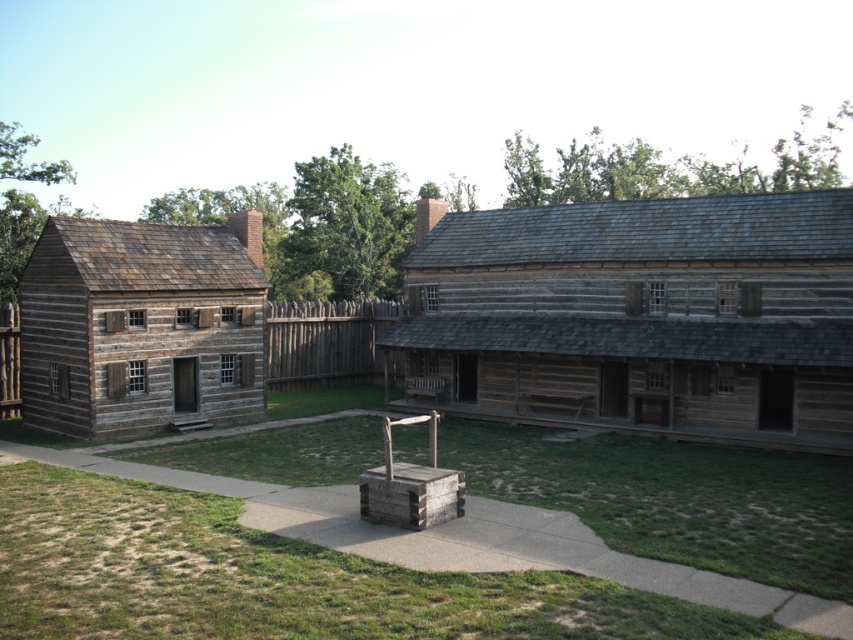
Does wooden well at center appear over light brown wooden log cabin at left?

Actually, wooden well at center is below light brown wooden log cabin at left.

Which is above, wooden well at center or light brown wooden log cabin at left?

Positioned higher is light brown wooden log cabin at left.

Describe the element at coordinates (274, 579) in the screenshot. This screenshot has width=853, height=640. I see `wooden well at center` at that location.

Locate an element on the screen. The image size is (853, 640). wooden well at center is located at coordinates (274, 579).

Is weathered brown wood log cabin at center in front of light brown wooden log cabin at left?

Yes, weathered brown wood log cabin at center is closer to the viewer.

Is point (740, 369) more distant than point (148, 225)?

No, (740, 369) is closer to viewer.

Does point (712, 209) come behind point (102, 413)?

Yes, it is behind point (102, 413).

I want to click on weathered brown wood log cabin at center, so click(640, 316).

Which is above, wooden well at center or weathered brown wood log cabin at center?

weathered brown wood log cabin at center

Can you confirm if wooden well at center is positioned to the right of weathered brown wood log cabin at center?

Incorrect, wooden well at center is not on the right side of weathered brown wood log cabin at center.

Is point (24, 440) closer to camera compared to point (784, 365)?

No, (24, 440) is behind (784, 365).

The height and width of the screenshot is (640, 853). I want to click on wooden well at center, so click(x=274, y=579).